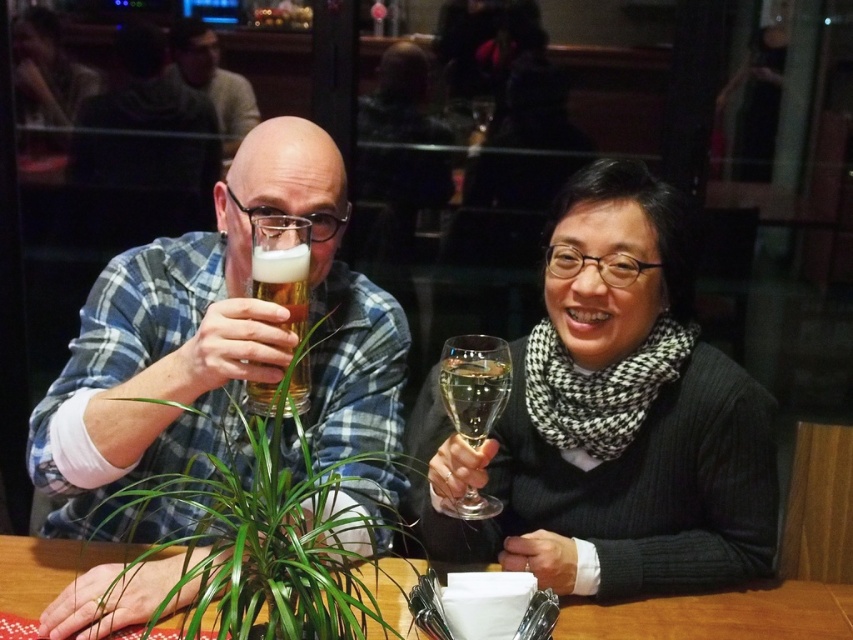
You are a server at the restaurant and need to deliver a dessert plate to the table. The dessert plate is 30 cm in diameter. Can you place it between the clear glass wine at center and the matte black shirt at upper left without disturbing either?

The distance between the clear glass wine at center and the matte black shirt at upper left is 1.44 meters. Since the dessert plate is only 30 cm wide, there is enough space to place it between them without disturbing either object.

You are sitting at the table in the restaurant scene. You notice two points marked on the table surface. The first point is at coordinates point (440, 371) and the second point is at point (224, 88). Which of these two points is closer to you?

Point (440, 371) is in front of point (224, 88), so it is closer to you.

You are a waiter in a restaurant and need to place a large dessert plate between the green leafy plant at center and the clear glass wine glass at right. Can you fit it there?

The green leafy plant at center is bigger than the clear glass wine glass at right, so there might not be enough space to fit a large dessert plate between them. Check the available space carefully before placing the plate.